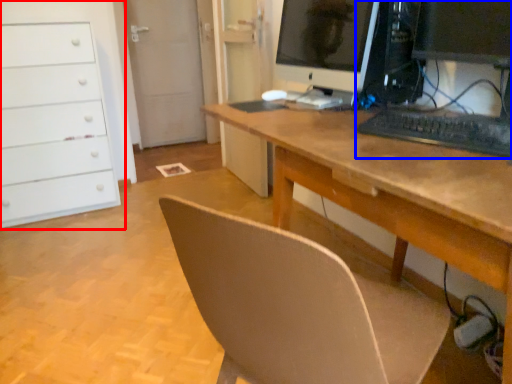
Question: Among these objects, which one is nearest to the camera, chest of drawers (highlighted by a red box) or computer (highlighted by a blue box)?

Choices:
 (A) chest of drawers
 (B) computer

Answer: (B)